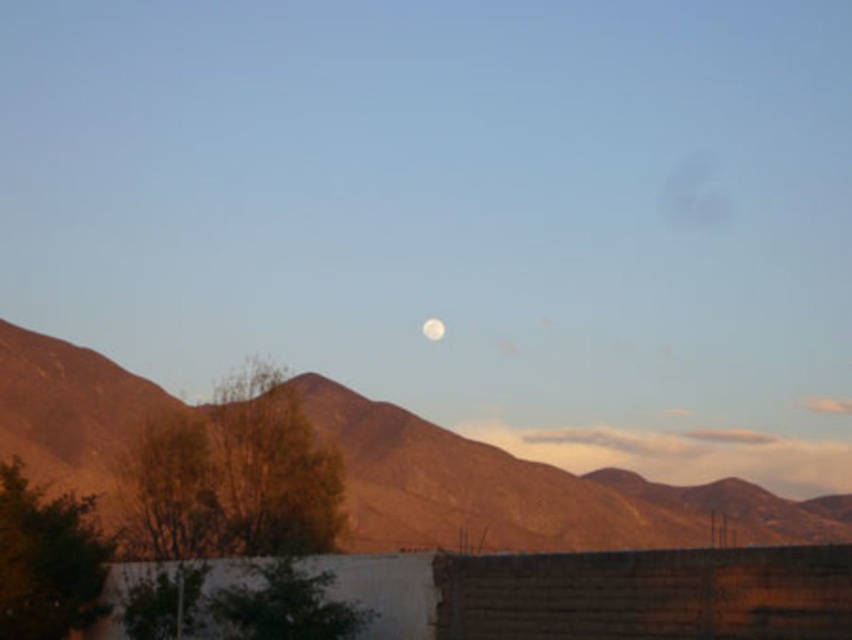
Does brown rocky mountain range at center have a lesser height compared to white glossy moon at center?

Incorrect, brown rocky mountain range at center's height does not fall short of white glossy moon at center's.

Which is more to the left, brown rocky mountain range at center or white glossy moon at center?

white glossy moon at center is more to the left.

Image resolution: width=852 pixels, height=640 pixels. Describe the element at coordinates (517, 492) in the screenshot. I see `brown rocky mountain range at center` at that location.

You are a GUI agent. You are given a task and a screenshot of the screen. Output one action in this format:
    pyautogui.click(x=<x>, y=<y>)
    Task: Click on the brown rocky mountain range at center
    The height and width of the screenshot is (640, 852).
    Given the screenshot: What is the action you would take?
    pyautogui.click(x=517, y=492)